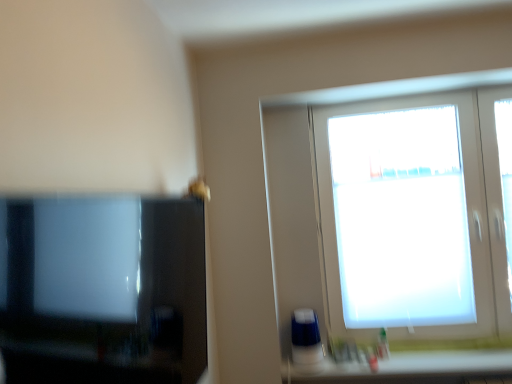
The height and width of the screenshot is (384, 512). Describe the element at coordinates (407, 368) in the screenshot. I see `white plastic container at lower right` at that location.

The width and height of the screenshot is (512, 384). Describe the element at coordinates (417, 215) in the screenshot. I see `white matte window at upper right` at that location.

Locate an element on the screen. The height and width of the screenshot is (384, 512). white matte window at upper right is located at coordinates click(417, 215).

Locate an element on the screen. This screenshot has height=384, width=512. translucent plastic bottle at lower right is located at coordinates (383, 344).

The image size is (512, 384). Find the location of `matte black tv at left`. matte black tv at left is located at coordinates (103, 290).

Between matte black tv at left and white matte window at upper right, which one has smaller size?

matte black tv at left is smaller.

How many degrees apart are the facing directions of matte black tv at left and white matte window at upper right?

The angular difference between matte black tv at left and white matte window at upper right is 89.8 degrees.

In order to click on television located underneath the white matte window at upper right (from a real-world perspective) in this screenshot , I will do `click(103, 290)`.

From a real-world perspective, is matte black tv at left on white matte window at upper right?

No, from a real-world perspective, matte black tv at left is not over white matte window at upper right

Find the location of a particular element. The image size is (512, 384). window sill in front of the translucent plastic bottle at lower right is located at coordinates (407, 368).

Between translucent plastic bottle at lower right and white plastic container at lower right, which one has smaller width?

With smaller width is translucent plastic bottle at lower right.

Considering the sizes of translucent plastic bottle at lower right and white plastic container at lower right in the image, is translucent plastic bottle at lower right bigger or smaller than white plastic container at lower right?

In the image, translucent plastic bottle at lower right appears to be smaller than white plastic container at lower right.

Considering the relative positions of translucent plastic bottle at lower right and white plastic container at lower right in the image provided, is translucent plastic bottle at lower right behind white plastic container at lower right?

Yes, translucent plastic bottle at lower right is further from the viewer.

Is matte black tv at left facing away from white plastic container at lower right?

No, matte black tv at left's orientation is not away from white plastic container at lower right.

Is matte black tv at left in front of or behind white plastic container at lower right in the image?

Visually, matte black tv at left is located in front of white plastic container at lower right.

How distant is matte black tv at left from white plastic container at lower right?

matte black tv at left and white plastic container at lower right are 1.30 meters apart.

Are white matte window at upper right and matte black tv at left located far from each other?

white matte window at upper right is positioned a significant distance from matte black tv at left.

Does white matte window at upper right have a lesser height compared to matte black tv at left?

Incorrect, the height of white matte window at upper right does not fall short of that of matte black tv at left.

Looking at their sizes, would you say white matte window at upper right is wider or thinner than matte black tv at left?

Considering their sizes, white matte window at upper right looks slimmer than matte black tv at left.

Considering the positions of point (413, 138) and point (95, 254), is point (413, 138) closer or farther from the camera than point (95, 254)?

Point (413, 138) is positioned farther from the camera compared to point (95, 254).

Is translucent plastic bottle at lower right oriented towards white matte window at upper right?

No, translucent plastic bottle at lower right does not turn towards white matte window at upper right.

Consider the image. From a real-world perspective, is translucent plastic bottle at lower right below white matte window at upper right?

Indeed, from a real-world perspective, translucent plastic bottle at lower right is positioned beneath white matte window at upper right.

The image size is (512, 384). I want to click on window located on the right of translucent plastic bottle at lower right, so click(x=417, y=215).

Are translucent plastic bottle at lower right and white matte window at upper right far apart?

No, translucent plastic bottle at lower right is not far from white matte window at upper right.

Which object is positioned more to the right, white plastic container at lower right or translucent plastic bottle at lower right?

From the viewer's perspective, white plastic container at lower right appears more on the right side.

Based on their sizes in the image, would you say white plastic container at lower right is bigger or smaller than translucent plastic bottle at lower right?

Clearly, white plastic container at lower right is larger in size than translucent plastic bottle at lower right.

Considering the relative sizes of white plastic container at lower right and translucent plastic bottle at lower right in the image provided, is white plastic container at lower right thinner than translucent plastic bottle at lower right?

In fact, white plastic container at lower right might be wider than translucent plastic bottle at lower right.

Are white plastic container at lower right and translucent plastic bottle at lower right making contact?

There is a gap between white plastic container at lower right and translucent plastic bottle at lower right.

Is point (373, 123) positioned before point (382, 352)?

No.

Considering the relative sizes of white matte window at upper right and translucent plastic bottle at lower right in the image provided, is white matte window at upper right thinner than translucent plastic bottle at lower right?

No.

I want to click on toiletry below the white matte window at upper right (from the image's perspective), so click(383, 344).

In the image, is white matte window at upper right positioned in front of or behind translucent plastic bottle at lower right?

Visually, white matte window at upper right is located in front of translucent plastic bottle at lower right.

The image size is (512, 384). I want to click on television below the white matte window at upper right (from a real-world perspective), so click(x=103, y=290).

This screenshot has height=384, width=512. I want to click on window sill on the right side of translucent plastic bottle at lower right, so click(407, 368).

Which object lies further to the anchor point translucent plastic bottle at lower right, white plastic container at lower right or matte black tv at left?

The object further to translucent plastic bottle at lower right is matte black tv at left.

Based on their spatial positions, is white matte window at upper right or matte black tv at left further from translucent plastic bottle at lower right?

Among the two, matte black tv at left is located further to translucent plastic bottle at lower right.

When comparing their distances from matte black tv at left, does white plastic container at lower right or white matte window at upper right seem further?

white matte window at upper right.

When comparing their distances from white plastic container at lower right, does matte black tv at left or translucent plastic bottle at lower right seem closer?

translucent plastic bottle at lower right is closer to white plastic container at lower right.

When comparing their distances from translucent plastic bottle at lower right, does white matte window at upper right or white plastic container at lower right seem further?

white matte window at upper right is further to translucent plastic bottle at lower right.

Based on their spatial positions, is white matte window at upper right or translucent plastic bottle at lower right further from white plastic container at lower right?

white matte window at upper right.

From the image, which object appears to be farther from white matte window at upper right, matte black tv at left or translucent plastic bottle at lower right?

matte black tv at left is further to white matte window at upper right.

Considering their positions, is white plastic container at lower right positioned closer to white matte window at upper right than matte black tv at left?

white plastic container at lower right.

Locate an element on the screen. Image resolution: width=512 pixels, height=384 pixels. window sill between matte black tv at left and white matte window at upper right along the z-axis is located at coordinates (407, 368).

Where is `toiletry between white matte window at upper right and white plastic container at lower right from top to bottom`? Image resolution: width=512 pixels, height=384 pixels. toiletry between white matte window at upper right and white plastic container at lower right from top to bottom is located at coordinates (383, 344).

The image size is (512, 384). I want to click on window sill positioned between matte black tv at left and translucent plastic bottle at lower right from near to far, so click(x=407, y=368).

Where is `window between matte black tv at left and translucent plastic bottle at lower right from front to back`? The height and width of the screenshot is (384, 512). window between matte black tv at left and translucent plastic bottle at lower right from front to back is located at coordinates (417, 215).